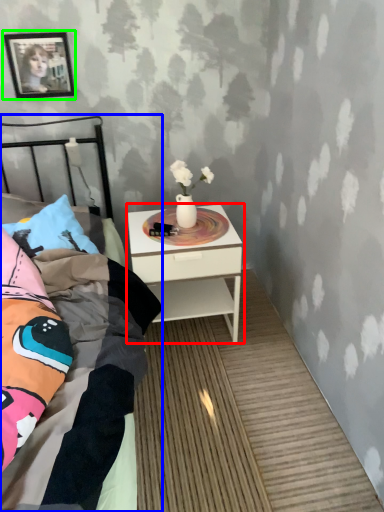
Question: Considering the real-world distances, which object is closest to nightstand (highlighted by a red box)? bed (highlighted by a blue box) or picture frame (highlighted by a green box).

Choices:
 (A) bed
 (B) picture frame

Answer: (A)